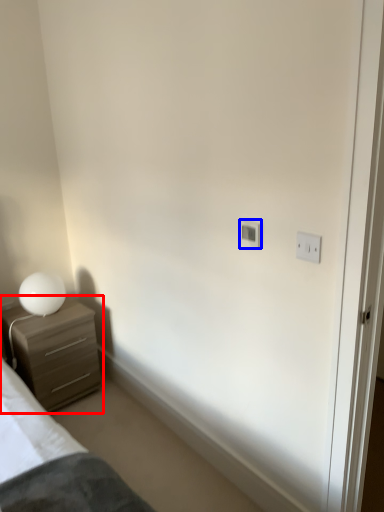
Question: Which object appears closest to the camera in this image, chest of drawers (highlighted by a red box) or light switch (highlighted by a blue box)?

Choices:
 (A) chest of drawers
 (B) light switch

Answer: (B)